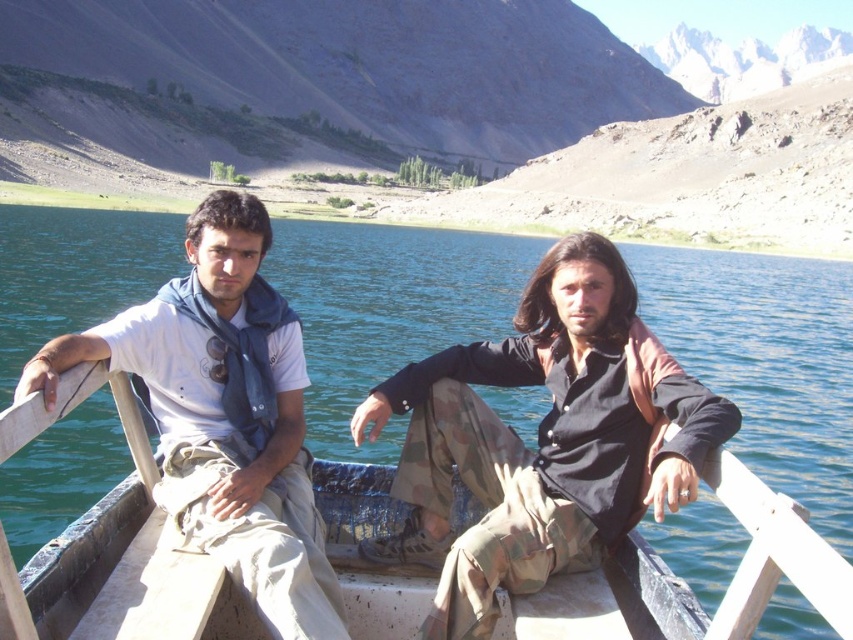
Can you confirm if clear blue water at center is wider than camouflage pants at center?

Yes.

Image resolution: width=853 pixels, height=640 pixels. What do you see at coordinates (769, 362) in the screenshot?
I see `clear blue water at center` at bounding box center [769, 362].

What do you see at coordinates (769, 362) in the screenshot?
I see `clear blue water at center` at bounding box center [769, 362].

You are a GUI agent. You are given a task and a screenshot of the screen. Output one action in this format:
    pyautogui.click(x=<x>, y=<y>)
    Task: Click on the clear blue water at center
    The width and height of the screenshot is (853, 640).
    Given the screenshot: What is the action you would take?
    pyautogui.click(x=769, y=362)

Measure the distance between camouflage pants at center and camera.

camouflage pants at center is 11.57 meters away from camera.

Is point (575, 516) closer to camera compared to point (172, 444)?

Yes, point (575, 516) is in front of point (172, 444).

Between point (364, 400) and point (49, 348), which one is positioned in front?

Point (49, 348)

Identify the location of camouflage pants at center. The width and height of the screenshot is (853, 640). (540, 440).

Identify the location of clear blue water at center. (769, 362).

Does point (415, 353) come behind point (292, 364)?

Yes, it is behind point (292, 364).

The width and height of the screenshot is (853, 640). What are the coordinates of `clear blue water at center` in the screenshot? It's located at (769, 362).

The image size is (853, 640). In order to click on clear blue water at center in this screenshot , I will do `click(769, 362)`.